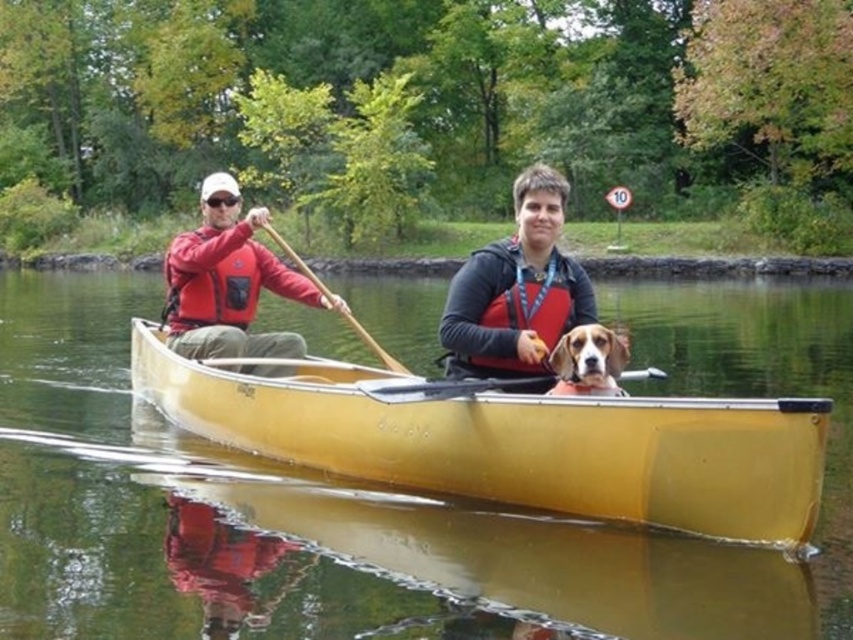
You are a safety inspector checking the canoe for proper equipment placement. According to the image, is the matte black life vest at center correctly placed over the wooden paddle at left?

The matte black life vest at center is positioned over the wooden paddle at left, so yes, it is correctly placed over the wooden paddle at left.

You are a lifeguard on duty and notice two people in a canoe. You see the red matte life jacket at left and the matte red life jacket at left. Which one is located to the left of the other?

The red matte life jacket at left is positioned on the left side of the matte red life jacket at left, so the first one is to the left of the second one.

You are a safety inspector checking the canoe for proper equipment. You notice the matte black life vest at center and the wooden paddle at left. Which item is taller?

The matte black life vest at center is taller than the wooden paddle at left.